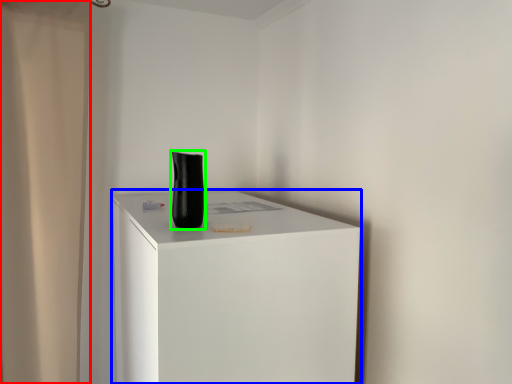
Question: Which object is positioned farthest from shower curtain (highlighted by a red box)? Select from furniture (highlighted by a blue box) and vase (highlighted by a green box).

Choices:
 (A) furniture
 (B) vase

Answer: (B)